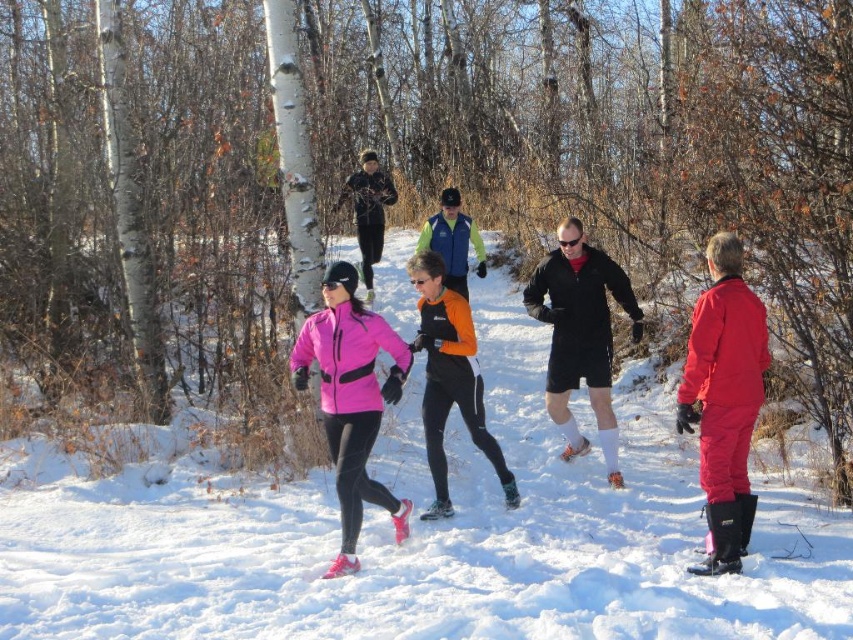
Does white fluffy snow at center have a greater width compared to matte blue vest at center?

No, white fluffy snow at center is not wider than matte blue vest at center.

Between white fluffy snow at center and matte blue vest at center, which one has less height?

white fluffy snow at center is shorter.

Describe the element at coordinates (419, 534) in the screenshot. I see `white fluffy snow at center` at that location.

Image resolution: width=853 pixels, height=640 pixels. Identify the location of white fluffy snow at center. (419, 534).

Can you confirm if matte red snowsuit at right is positioned above matte blue vest at center?

No, matte red snowsuit at right is not above matte blue vest at center.

Image resolution: width=853 pixels, height=640 pixels. What do you see at coordinates (724, 397) in the screenshot?
I see `matte red snowsuit at right` at bounding box center [724, 397].

I want to click on matte red snowsuit at right, so click(724, 397).

Consider the image. How much distance is there between white fluffy snow at center and matte pink jacket at center?

1.73 meters

Does white fluffy snow at center appear over matte pink jacket at center?

Actually, white fluffy snow at center is below matte pink jacket at center.

Between point (492, 502) and point (323, 355), which one is positioned in front?

Point (323, 355) is more forward.

Where is `white fluffy snow at center`? The height and width of the screenshot is (640, 853). white fluffy snow at center is located at coordinates (419, 534).